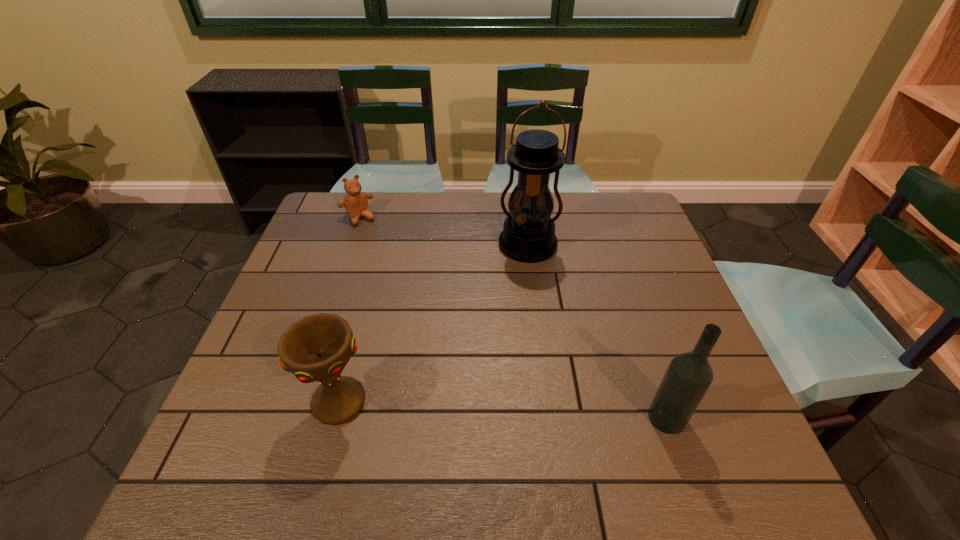
Choose a point located 0.120m above the lantern, indicating its light source in the vacant region. Please provide its 2D coordinates. Your answer should be formatted as a tuple, i.e. [(x, y)], where the tuple contains the x and y coordinates of a point satisfying the conditions above.

[(516, 296)]

This screenshot has width=960, height=540. I want to click on free location located on the face of the shortest object, so point(417,307).

Image resolution: width=960 pixels, height=540 pixels. In order to click on vacant region located 0.120m on the face of the shortest object in this screenshot , I will do `click(378, 247)`.

Locate an element on the screen. This screenshot has width=960, height=540. vacant space located on the face of the shortest object is located at coordinates (373, 240).

Where is `lantern positioned at the far edge`? lantern positioned at the far edge is located at coordinates (528, 235).

This screenshot has width=960, height=540. I want to click on teddy bear present at the far edge, so click(355, 202).

At what (x,y) coordinates should I click in order to perform the action: click on chalice that is at the near edge. Please return your answer as a coordinate pair (x, y). This screenshot has width=960, height=540. Looking at the image, I should click on (315, 348).

Identify the location of vodka positioned at the near edge. This screenshot has width=960, height=540. (689, 375).

The width and height of the screenshot is (960, 540). What are the coordinates of `object situated at the left edge` in the screenshot? It's located at (355, 202).

The width and height of the screenshot is (960, 540). I want to click on object that is at the right edge, so click(x=689, y=375).